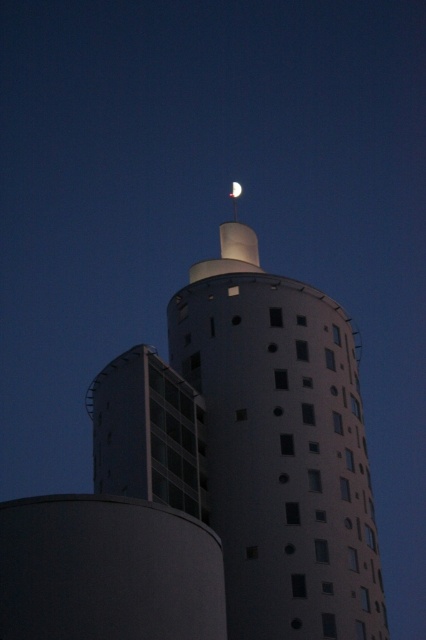
You are an architect reviewing the design of the white matte tower at upper center and the silver metallic moon at upper center. Which object would block the view of the other from an observer standing directly in front of them?

The white matte tower at upper center is in front of the silver metallic moon at upper center, so it would block the view of the moon from an observer standing directly in front of them.

You are standing 50 meters away from the white matte tower at upper center. Can you safely walk towards it without getting too close?

The distance between you and the white matte tower at upper center is 54.03 meters, so you are currently 4.03 meters away from the safe distance. Therefore, you need to move back to maintain a safe distance.

You are an architect designing a new building and want to ensure that the white matte tower at upper center does not block the view of the silver metallic moon at upper center from the observation deck. Based on the image, can you determine if the tower is wider than the moon?

The white matte tower at upper center might be wider than silver metallic moon at upper center, so there is a possibility that the tower could block the view of the moon from the observation deck.